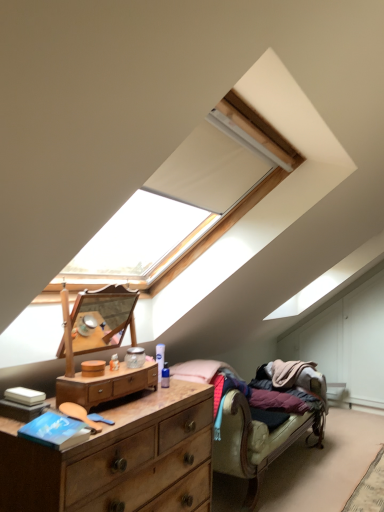
At what (x,y) coordinates should I click in order to perform the action: click on empty space that is ontop of wooden dresser at center, acting as the 1th chest of drawers starting from the top (from a real-world perspective). Please return your answer as a coordinate pair (x, y). Looking at the image, I should click on (115, 369).